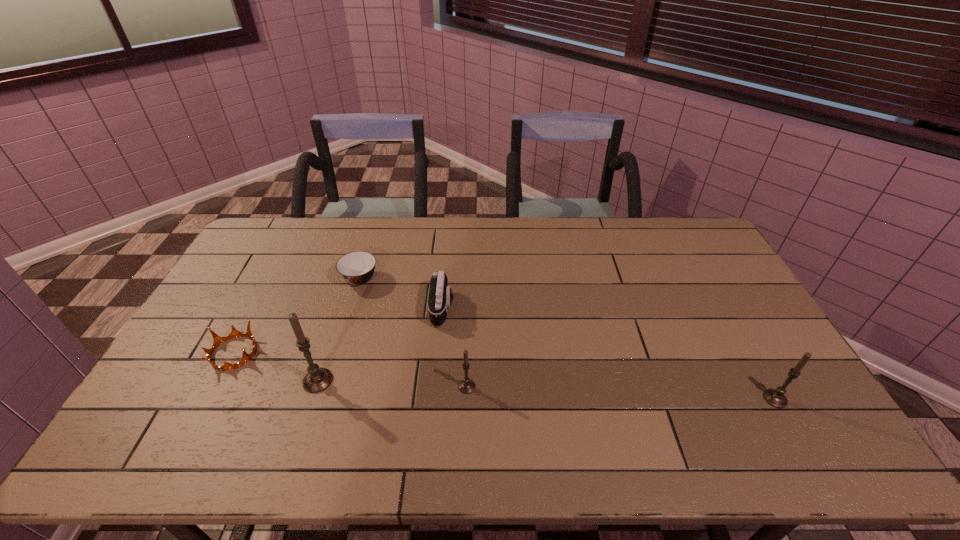
Find the location of a particular element. The image size is (960, 540). the tallest object is located at coordinates click(x=317, y=379).

Identify the location of the tallest candle. (317, 379).

Locate an element on the screen. This screenshot has height=540, width=960. the shortest candle is located at coordinates (466, 386).

What are the coordinates of `the second candle from left to right` in the screenshot? It's located at (466, 386).

Where is `the second tallest candle`? the second tallest candle is located at coordinates (776, 398).

You are a GUI agent. You are given a task and a screenshot of the screen. Output one action in this format:
    pyautogui.click(x=<x>, y=<y>)
    Task: Click on the second tallest object
    The image size is (960, 540).
    Given the screenshot: What is the action you would take?
    pyautogui.click(x=776, y=398)

Image resolution: width=960 pixels, height=540 pixels. What are the coordinates of `soup bowl` in the screenshot? It's located at (357, 268).

Image resolution: width=960 pixels, height=540 pixels. What are the coordinates of `crown` in the screenshot? It's located at (218, 340).

You are a GUI agent. You are given a task and a screenshot of the screen. Output one action in this format:
    pyautogui.click(x=<x>, y=<y>)
    Task: Click on the camera
    The width and height of the screenshot is (960, 540).
    Given the screenshot: What is the action you would take?
    click(440, 297)

The width and height of the screenshot is (960, 540). In order to click on the third object from right to left in this screenshot , I will do `click(440, 297)`.